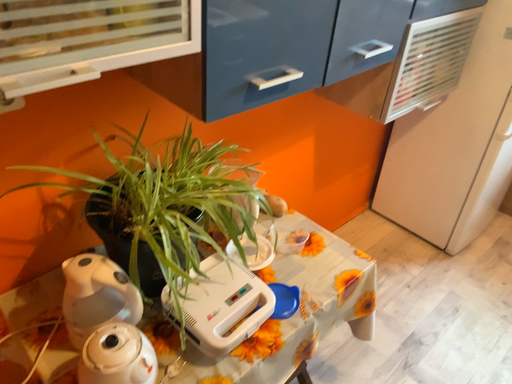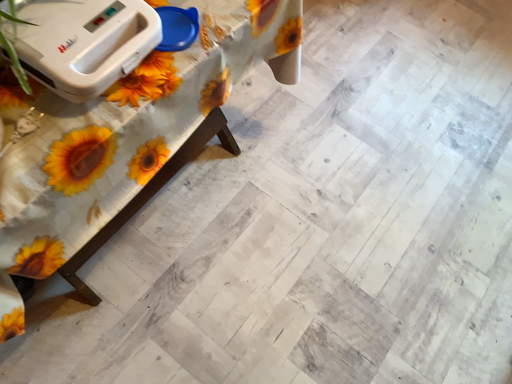
Question: How did the camera likely rotate when shooting the video?

Choices:
 (A) rotated downward
 (B) rotated upward

Answer: (A)